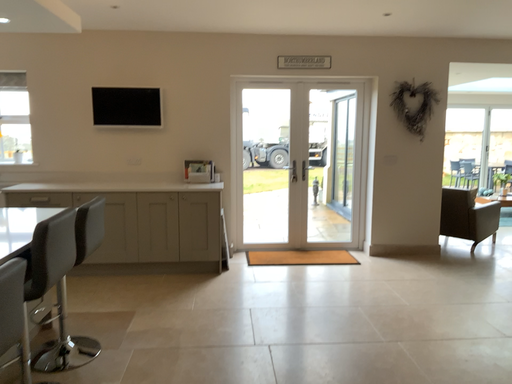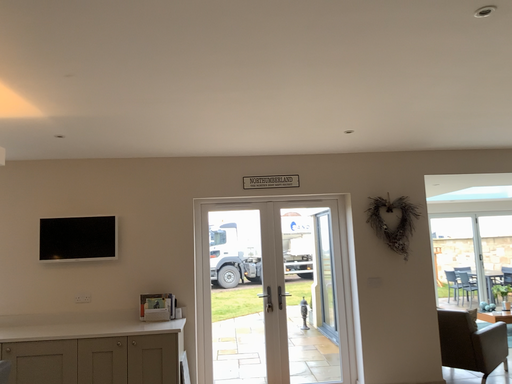
Question: How did the camera likely rotate when shooting the video?

Choices:
 (A) rotated downward
 (B) rotated upward

Answer: (B)